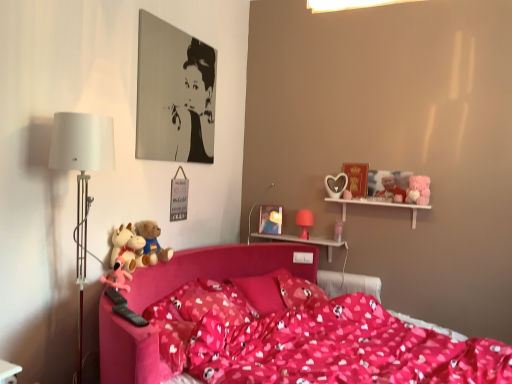
Identify the location of vacant area on top of white wooden shelf at upper right (from a real-world perspective). The image size is (512, 384). (379, 199).